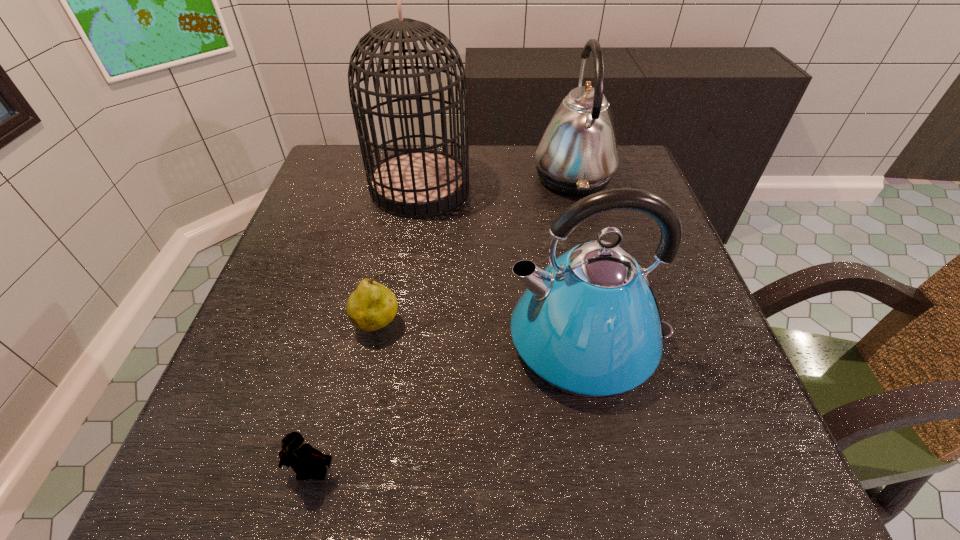
This screenshot has width=960, height=540. Identify the location of object that ranks as the third closest to the pear. (413, 183).

Locate an element on the screen. The height and width of the screenshot is (540, 960). free space in the image that satisfies the following two spatial constraints: 1. on the back side of the birdcage; 2. on the right side of the pear is located at coordinates [406, 188].